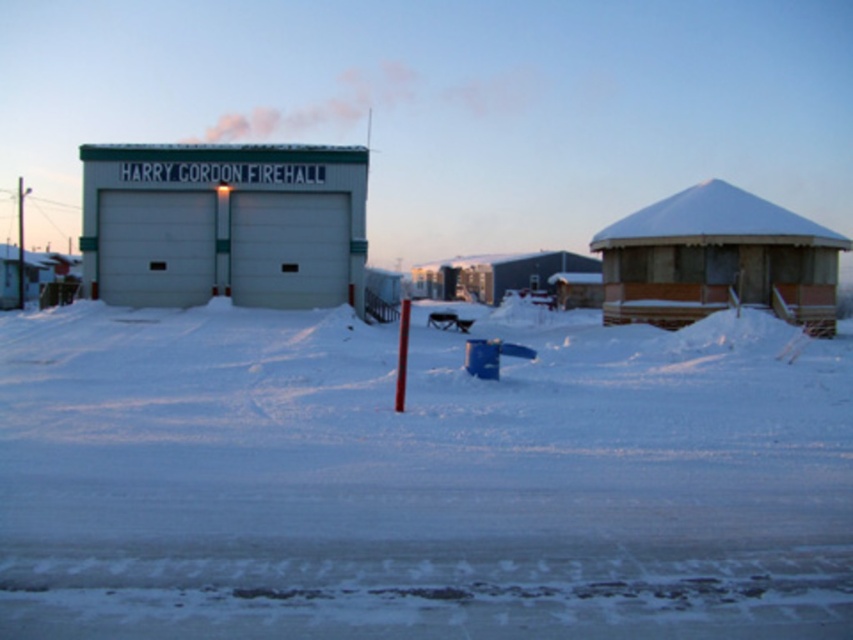
Question: Which object appears closest to the camera in this image?

Choices:
 (A) white powdery snow at center
 (B) wooden cabin at right

Answer: (A)

Question: Which point is farther to the camera?

Choices:
 (A) white matte firehall at center
 (B) wooden cabin at right
 (C) white powdery snow at center

Answer: (A)

Question: Which object is farther from the camera taking this photo?

Choices:
 (A) white matte firehall at center
 (B) white powdery snow at center
 (C) wooden cabin at right

Answer: (A)

Question: Can you confirm if white powdery snow at center is wider than wooden cabin at right?

Choices:
 (A) yes
 (B) no

Answer: (A)

Question: Can you confirm if white matte firehall at center is thinner than wooden cabin at right?

Choices:
 (A) no
 (B) yes

Answer: (A)

Question: Is white matte firehall at center positioned at the back of wooden cabin at right?

Choices:
 (A) no
 (B) yes

Answer: (B)